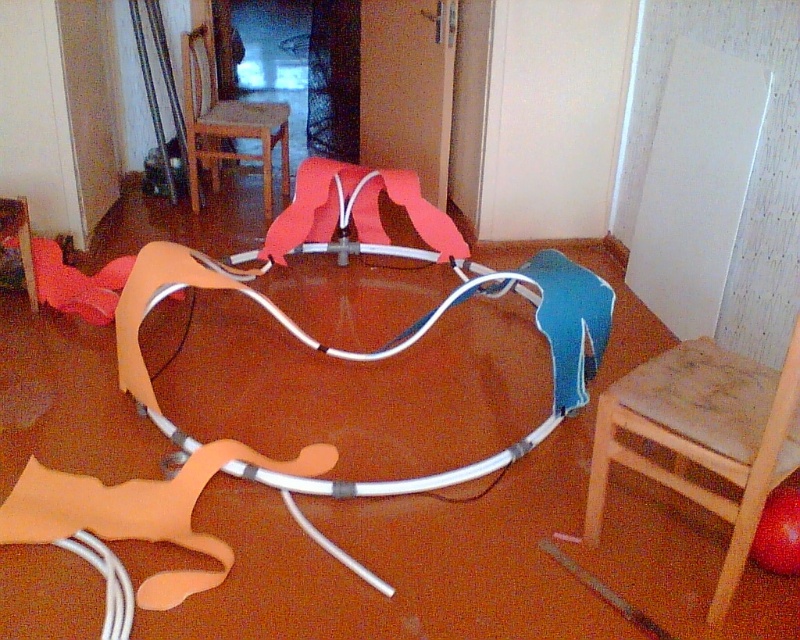
Does wooden stool at lower right lie in front of wooden chair at upper center?

Yes, it is.

Is point (729, 412) closer to viewer compared to point (218, 113)?

Yes, point (729, 412) is in front of point (218, 113).

Who is more distant from viewer, (790,396) or (206,28)?

The point (206,28) is behind.

Image resolution: width=800 pixels, height=640 pixels. Identify the location of wooden stool at lower right. (704, 436).

Is metallic silver table at center below metallic silver hula hoop at center?

Indeed, metallic silver table at center is positioned under metallic silver hula hoop at center.

Between point (126, 328) and point (550, 292), which one is positioned behind?

The point (550, 292) is more distant.

Looking at this image, who is more distant from viewer, [356,568] or [226,284]?

Positioned behind is point [226,284].

Identify the location of metallic silver table at center. The image size is (800, 640). (380, 358).

Does metallic silver hula hoop at center appear under wooden chair at upper center?

Indeed, metallic silver hula hoop at center is positioned under wooden chair at upper center.

Is metallic silver hula hoop at center wider than wooden chair at upper center?

Correct, the width of metallic silver hula hoop at center exceeds that of wooden chair at upper center.

Is point (568, 317) closer to camera compared to point (208, 152)?

That is True.

Locate an element on the screen. This screenshot has height=640, width=800. metallic silver hula hoop at center is located at coordinates (384, 348).